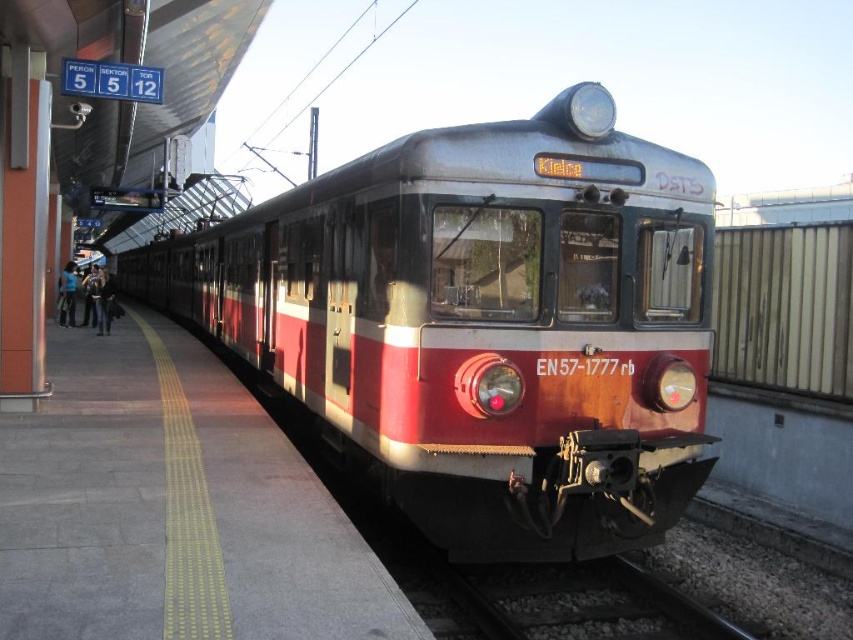
You are standing at the point marked as point [502,496] at the train station. You want to take a photo of the train EN57 1777 rb with your camera. Can you capture the entire train in your photo without moving your camera position? Explain your reasoning.

The point [502,496] and the camera are 5.70 meters apart. Since the distance is fixed, whether the entire train can be captured depends on the camera lens and field of view. However, the provided information does not include details about the camera specifications. Therefore, it is impossible to determine if the entire train can be captured without additional information.

You are standing on the platform at the station and want to board the red matte train at center. Based on the coordinates provided in the Objects Description, can you determine if the train is positioned directly in front of you or slightly to one side?

The red matte train at center is located at coordinates point (482, 324), which indicates it is centered relative to the platform. Therefore, the train is positioned directly in front of you.

You are standing on the platform at the train station. There is a point marked at coordinates (482, 324). Based on the scene, can you tell me what object this point is located on?

The point marked at coordinates (482, 324) is located on the red matte train at center.